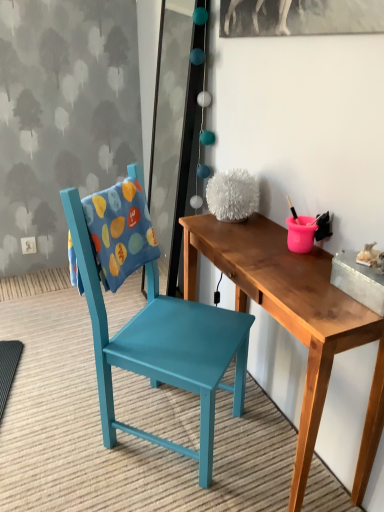
You are a GUI agent. You are given a task and a screenshot of the screen. Output one action in this format:
    pyautogui.click(x=<x>, y=<y>)
    Task: Click on the vacant space underneath teal painted wood chair at left (from a real-world perspective)
    
    Given the screenshot: What is the action you would take?
    pyautogui.click(x=163, y=415)